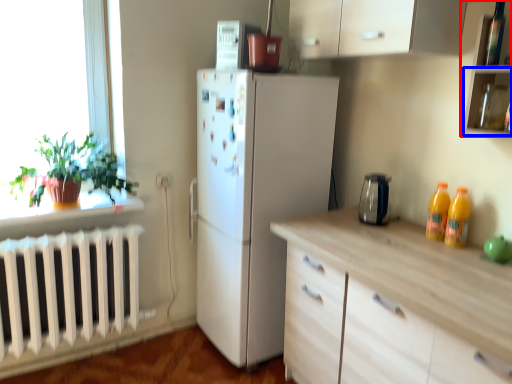
Question: Among these objects, which one is nearest to the camera, cabinetry (highlighted by a red box) or shelf (highlighted by a blue box)?

Choices:
 (A) cabinetry
 (B) shelf

Answer: (A)